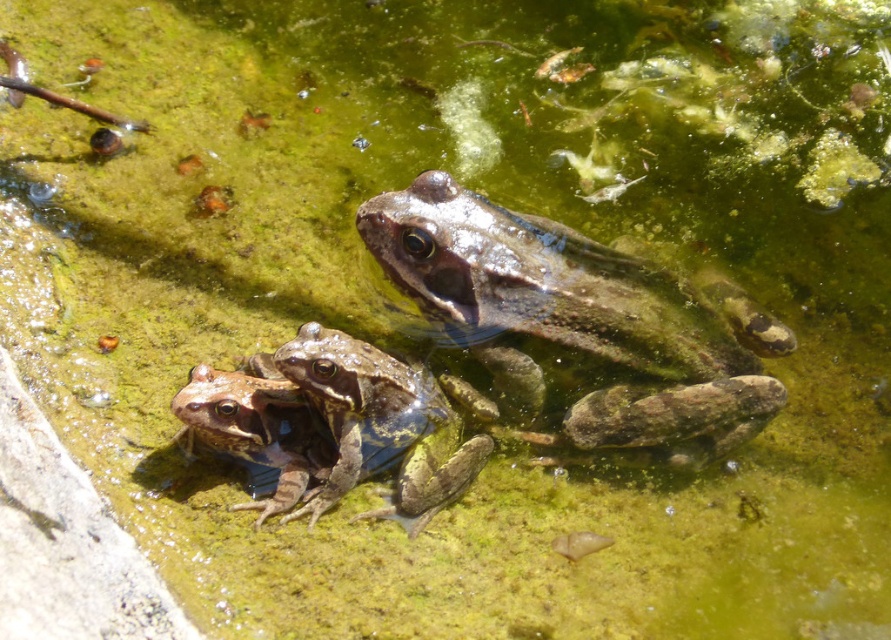
Which of these two, camouflage skin frog at center or camouflage-patterned frog at center, stands taller?

camouflage skin frog at center

Is camouflage skin frog at center taller than camouflage-patterned frog at center?

Correct, camouflage skin frog at center is much taller as camouflage-patterned frog at center.

Which is in front, point (511, 314) or point (378, 372)?

Positioned in front is point (378, 372).

At what (x,y) coordinates should I click in order to perform the action: click on camouflage skin frog at center. Please return your answer as a coordinate pair (x, y). This screenshot has height=640, width=891. Looking at the image, I should click on (582, 321).